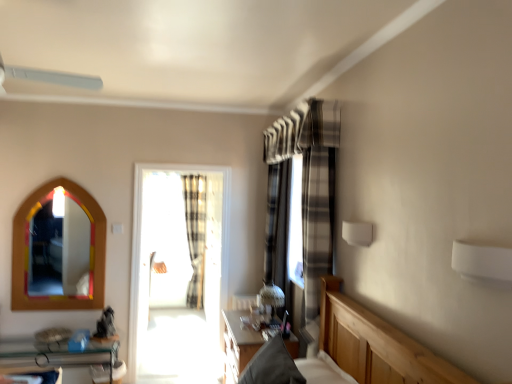
Question: Is multicolored wooden mirror at left taller than plaid fabric curtain at center, the 2th curtain viewed from the front?

Choices:
 (A) no
 (B) yes

Answer: (A)

Question: From the image's perspective, would you say multicolored wooden mirror at left is positioned over plaid fabric curtain at center, the 2th curtain viewed from the front?

Choices:
 (A) yes
 (B) no

Answer: (A)

Question: Could plaid fabric curtain at center, the 1th curtain viewed from the back, be considered to be inside multicolored wooden mirror at left?

Choices:
 (A) yes
 (B) no

Answer: (B)

Question: Can you confirm if multicolored wooden mirror at left is shorter than plaid fabric curtain at center, the 1th curtain viewed from the back?

Choices:
 (A) no
 (B) yes

Answer: (B)

Question: Considering the relative sizes of multicolored wooden mirror at left and plaid fabric curtain at center, which ranks as the second curtain in right-to-left order, in the image provided, is multicolored wooden mirror at left bigger than plaid fabric curtain at center, which ranks as the second curtain in right-to-left order,?

Choices:
 (A) no
 (B) yes

Answer: (A)

Question: From the image's perspective, is white plastic fan at upper left located above or below multicolored wooden mirror at left?

Choices:
 (A) below
 (B) above

Answer: (B)

Question: Is point (50, 79) closer or farther from the camera than point (61, 271)?

Choices:
 (A) closer
 (B) farther

Answer: (A)

Question: Is white plastic fan at upper left inside or outside of multicolored wooden mirror at left?

Choices:
 (A) outside
 (B) inside

Answer: (A)

Question: In terms of width, does white plastic fan at upper left look wider or thinner when compared to multicolored wooden mirror at left?

Choices:
 (A) thin
 (B) wide

Answer: (B)

Question: In the image, is plaid fabric curtain at center, the first curtain in the right-to-left sequence, positioned in front of or behind plaid fabric curtain at center, which ranks as the second curtain in right-to-left order?

Choices:
 (A) front
 (B) behind

Answer: (A)

Question: From their relative heights in the image, would you say plaid fabric curtain at center, which is counted as the second curtain, starting from the left, is taller or shorter than plaid fabric curtain at center, the 2th curtain viewed from the front?

Choices:
 (A) short
 (B) tall

Answer: (A)

Question: Which is correct: plaid fabric curtain at center, acting as the 1th curtain starting from the front, is inside plaid fabric curtain at center, the 2th curtain viewed from the front, or outside of it?

Choices:
 (A) inside
 (B) outside

Answer: (B)

Question: Is plaid fabric curtain at center, the first curtain in the right-to-left sequence, wider or thinner than plaid fabric curtain at center, the 1th curtain viewed from the back?

Choices:
 (A) thin
 (B) wide

Answer: (B)

Question: Looking at the image, does plaid fabric curtain at center, which ranks as the second curtain in right-to-left order, seem bigger or smaller compared to clear glass shelf at lower left?

Choices:
 (A) big
 (B) small

Answer: (B)

Question: Considering their positions, is plaid fabric curtain at center, arranged as the first curtain when viewed from the left, located in front of or behind clear glass shelf at lower left?

Choices:
 (A) behind
 (B) front

Answer: (A)